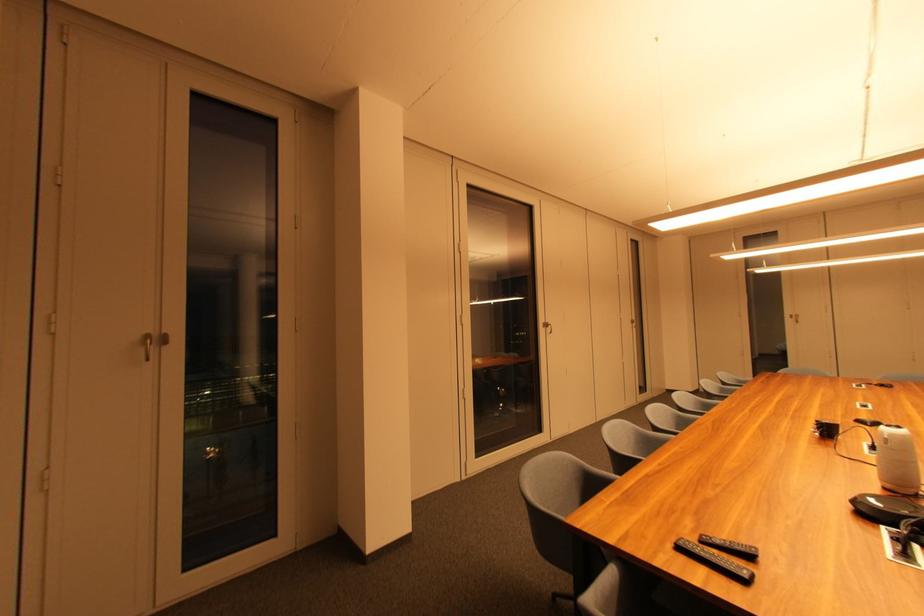
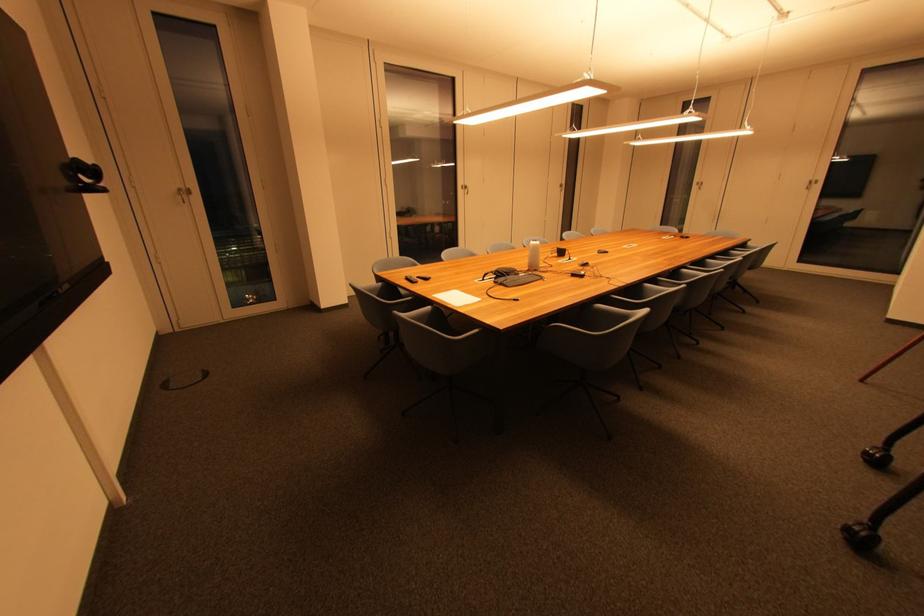
In the second image, find the point that corresponds to (686,551) in the first image.

(411, 281)